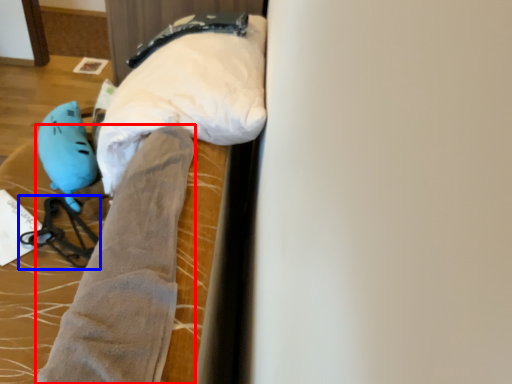
Question: Which object appears closest to the camera in this image, tight (highlighted by a red box) or twin (highlighted by a blue box)?

Choices:
 (A) tight
 (B) twin

Answer: (A)